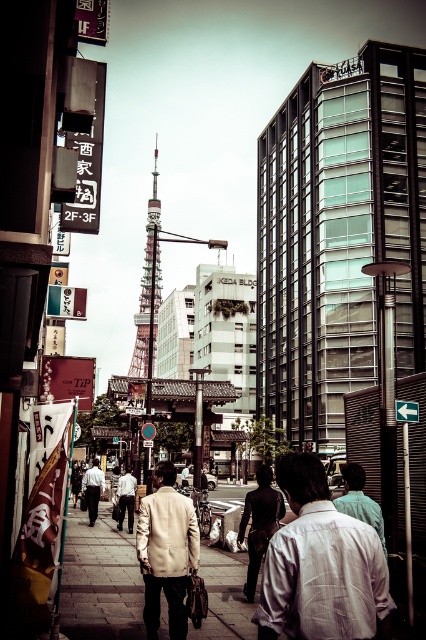
You are a photographer standing on the sidewalk in this busy street scene. You notice two people wearing a white textured shirt at center and a light beige jacket at center. Which clothing item is positioned higher on their body?

The white textured shirt at center is located above the light beige jacket at center, so the white textured shirt at center is positioned higher on their body.

You are a photographer standing on the sidewalk in this busy street scene. You want to take a photo that includes both the white textured shirt at center and the light beige jacket at center. Which clothing item will appear larger in your photo?

The white textured shirt at center will appear larger in the photo because it is closer to the viewer than the light beige jacket at center.